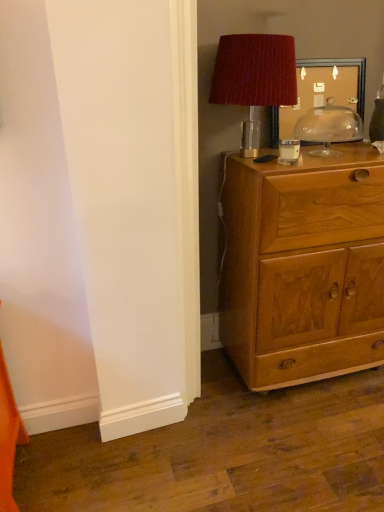
Image resolution: width=384 pixels, height=512 pixels. What do you see at coordinates (328, 127) in the screenshot?
I see `transparent glass dome at upper right` at bounding box center [328, 127].

This screenshot has height=512, width=384. I want to click on velvet red lampshade at upper right, so click(255, 77).

I want to click on transparent glass dome at upper right, so point(328,127).

Visually, is velvet red lampshade at upper right positioned to the left or to the right of wooden picture frame at upper right?

In the image, velvet red lampshade at upper right appears on the left side of wooden picture frame at upper right.

How different are the orientations of velvet red lampshade at upper right and wooden picture frame at upper right in degrees?

The facing directions of velvet red lampshade at upper right and wooden picture frame at upper right are 0.764 degrees apart.

Is velvet red lampshade at upper right behind wooden picture frame at upper right?

No, velvet red lampshade at upper right is in front of wooden picture frame at upper right.

From a real-world perspective, is velvet red lampshade at upper right above or below wooden picture frame at upper right?

velvet red lampshade at upper right is above wooden picture frame at upper right.

Is transparent glass dome at upper right surrounding velvet red lampshade at upper right?

No, velvet red lampshade at upper right is not surrounded by transparent glass dome at upper right.

From the image's perspective, would you say transparent glass dome at upper right is positioned over velvet red lampshade at upper right?

No, from the image's perspective, transparent glass dome at upper right is not over velvet red lampshade at upper right.

Is transparent glass dome at upper right further to the viewer compared to velvet red lampshade at upper right?

Yes, transparent glass dome at upper right is behind velvet red lampshade at upper right.

Considering the relative positions of velvet red lampshade at upper right and wooden cabinet at right in the image provided, is velvet red lampshade at upper right to the left of wooden cabinet at right from the viewer's perspective?

Yes.

In the scene shown: Measure the distance from velvet red lampshade at upper right to wooden cabinet at right.

24.38 inches.

The height and width of the screenshot is (512, 384). Find the location of `the chest of drawers directly beneath the velvet red lampshade at upper right (from a real-world perspective)`. the chest of drawers directly beneath the velvet red lampshade at upper right (from a real-world perspective) is located at coordinates (303, 268).

In the scene shown: Is velvet red lampshade at upper right positioned beyond the bounds of wooden cabinet at right?

Absolutely, velvet red lampshade at upper right is external to wooden cabinet at right.

From a real-world perspective, which object rests below the other?

wooden cabinet at right.

Are wooden cabinet at right and wooden picture frame at upper right beside each other?

No, wooden cabinet at right is not beside wooden picture frame at upper right.

Considering the relative sizes of wooden cabinet at right and wooden picture frame at upper right in the image provided, is wooden cabinet at right wider than wooden picture frame at upper right?

Indeed, wooden cabinet at right has a greater width compared to wooden picture frame at upper right.

Based on the photo, between wooden cabinet at right and wooden picture frame at upper right, which one appears on the left side from the viewer's perspective?

From the viewer's perspective, wooden picture frame at upper right appears more on the left side.

From the picture: Is transparent glass dome at upper right inside wooden picture frame at upper right?

No, transparent glass dome at upper right is located outside of wooden picture frame at upper right.

Can you confirm if wooden picture frame at upper right is taller than transparent glass dome at upper right?

Yes.

Are wooden picture frame at upper right and transparent glass dome at upper right far apart?

No.

Between wooden picture frame at upper right and transparent glass dome at upper right, which one appears on the right side from the viewer's perspective?

From the viewer's perspective, transparent glass dome at upper right appears more on the right side.

Considering the relative sizes of velvet red lampshade at upper right and transparent glass dome at upper right in the image provided, is velvet red lampshade at upper right shorter than transparent glass dome at upper right?

Incorrect, the height of velvet red lampshade at upper right does not fall short of that of transparent glass dome at upper right.

Which object is positioned more to the left, velvet red lampshade at upper right or transparent glass dome at upper right?

velvet red lampshade at upper right.

Is the surface of velvet red lampshade at upper right in direct contact with transparent glass dome at upper right?

No, velvet red lampshade at upper right is not beside transparent glass dome at upper right.

Who is bigger, transparent glass dome at upper right or wooden cabinet at right?

wooden cabinet at right.

Does transparent glass dome at upper right turn towards wooden cabinet at right?

No, transparent glass dome at upper right does not turn towards wooden cabinet at right.

How different are the orientations of transparent glass dome at upper right and wooden cabinet at right in degrees?

The facing directions of transparent glass dome at upper right and wooden cabinet at right are 0.763 degrees apart.

From the image's perspective, between transparent glass dome at upper right and wooden cabinet at right, who is located below?

wooden cabinet at right appears lower in the image.

This screenshot has width=384, height=512. I want to click on picture frame located behind the velvet red lampshade at upper right, so click(325, 91).

Image resolution: width=384 pixels, height=512 pixels. I want to click on lamp above the transparent glass dome at upper right (from the image's perspective), so click(x=255, y=77).

Considering their positions, is wooden picture frame at upper right positioned closer to transparent glass dome at upper right than velvet red lampshade at upper right?

wooden picture frame at upper right is closer to transparent glass dome at upper right.

Based on their spatial positions, is transparent glass dome at upper right or wooden picture frame at upper right further from velvet red lampshade at upper right?

transparent glass dome at upper right lies further to velvet red lampshade at upper right than the other object.

Estimate the real-world distances between objects in this image. Which object is further from velvet red lampshade at upper right, wooden picture frame at upper right or wooden cabinet at right?

wooden cabinet at right is positioned further to the anchor velvet red lampshade at upper right.

When comparing their distances from transparent glass dome at upper right, does wooden cabinet at right or wooden picture frame at upper right seem closer?

Among the two, wooden picture frame at upper right is located nearer to transparent glass dome at upper right.

Which object lies nearer to the anchor point transparent glass dome at upper right, wooden cabinet at right or velvet red lampshade at upper right?

The object closer to transparent glass dome at upper right is velvet red lampshade at upper right.

Based on the photo, from the image, which object appears to be nearer to wooden cabinet at right, velvet red lampshade at upper right or wooden picture frame at upper right?

Based on the image, wooden picture frame at upper right appears to be nearer to wooden cabinet at right.

When comparing their distances from wooden cabinet at right, does wooden picture frame at upper right or velvet red lampshade at upper right seem closer?

Among the two, wooden picture frame at upper right is located nearer to wooden cabinet at right.

Looking at this image, which object lies further to the anchor point velvet red lampshade at upper right, transparent glass dome at upper right or wooden cabinet at right?

wooden cabinet at right lies further to velvet red lampshade at upper right than the other object.

Identify the location of picture frame situated between velvet red lampshade at upper right and transparent glass dome at upper right from left to right. The width and height of the screenshot is (384, 512). (325, 91).

Locate an element on the screen. table lamp between velvet red lampshade at upper right and wooden cabinet at right from top to bottom is located at coordinates (328, 127).

The width and height of the screenshot is (384, 512). I want to click on table lamp between wooden picture frame at upper right and wooden cabinet at right from top to bottom, so click(328, 127).

Image resolution: width=384 pixels, height=512 pixels. Identify the location of lamp between wooden picture frame at upper right and wooden cabinet at right from top to bottom. (255, 77).